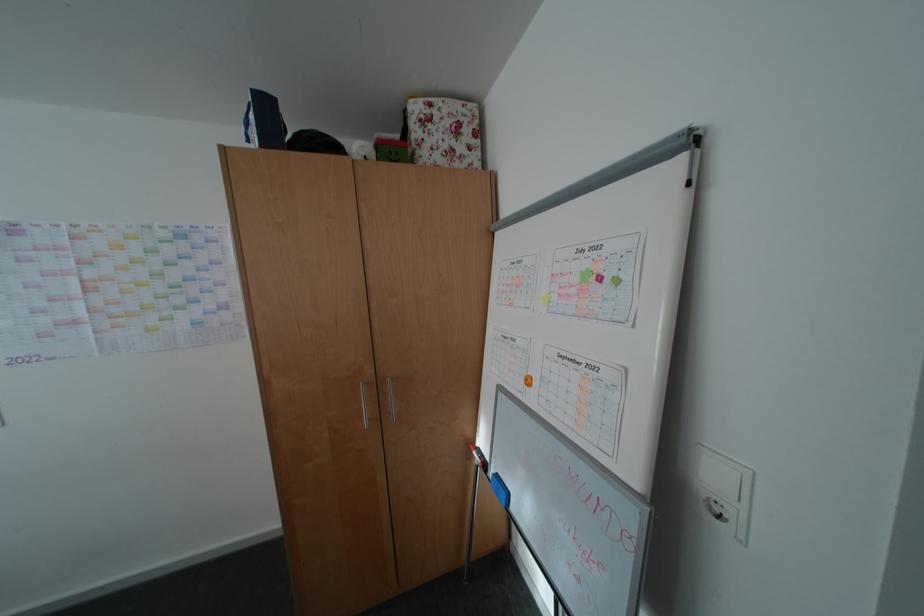
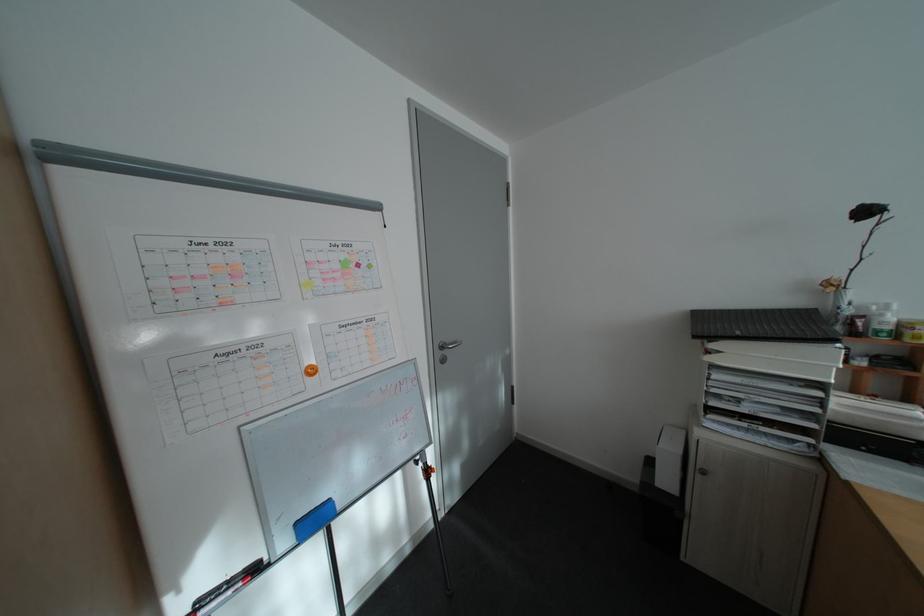
Question: How did the camera likely rotate?

Choices:
 (A) Left
 (B) Right
 (C) Up
 (D) Down

Answer: (B)